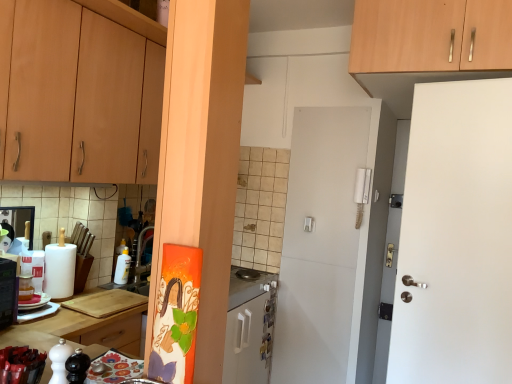
Question: Does white plastic salt shaker at lower left have a greater height compared to wooden cutting board at lower center?

Choices:
 (A) no
 (B) yes

Answer: (A)

Question: Is white plastic salt shaker at lower left located outside wooden cutting board at lower center?

Choices:
 (A) yes
 (B) no

Answer: (A)

Question: Is wooden cutting board at lower center at the back of white plastic salt shaker at lower left?

Choices:
 (A) no
 (B) yes

Answer: (A)

Question: From the image's perspective, would you say white plastic salt shaker at lower left is positioned over wooden cutting board at lower center?

Choices:
 (A) yes
 (B) no

Answer: (A)

Question: From a real-world perspective, is white plastic salt shaker at lower left positioned over wooden cutting board at lower center based on gravity?

Choices:
 (A) yes
 (B) no

Answer: (A)

Question: In the image, is wooden cutting board at lower center on the left side or the right side of stainless steel gas stove at center?

Choices:
 (A) right
 (B) left

Answer: (B)

Question: In terms of height, does wooden cutting board at lower center look taller or shorter compared to stainless steel gas stove at center?

Choices:
 (A) tall
 (B) short

Answer: (A)

Question: Based on their sizes in the image, would you say wooden cutting board at lower center is bigger or smaller than stainless steel gas stove at center?

Choices:
 (A) big
 (B) small

Answer: (A)

Question: From a real-world perspective, relative to stainless steel gas stove at center, is wooden cutting board at lower center vertically above or below?

Choices:
 (A) above
 (B) below

Answer: (B)

Question: From their relative heights in the image, would you say white plastic salt shaker at lower left is taller or shorter than wooden cutting board at lower left?

Choices:
 (A) short
 (B) tall

Answer: (A)

Question: In the image, is white plastic salt shaker at lower left positioned in front of or behind wooden cutting board at lower left?

Choices:
 (A) front
 (B) behind

Answer: (A)

Question: From a real-world perspective, is white plastic salt shaker at lower left physically located above or below wooden cutting board at lower left?

Choices:
 (A) below
 (B) above

Answer: (B)

Question: From the image's perspective, relative to wooden cutting board at lower left, is white plastic salt shaker at lower left above or below?

Choices:
 (A) above
 (B) below

Answer: (A)

Question: From the image's perspective, is wooden cabinet at upper right, which is the 2th cabinetry from left to right, positioned above or below white plastic salt shaker at lower left?

Choices:
 (A) below
 (B) above

Answer: (B)

Question: From a real-world perspective, relative to white plastic salt shaker at lower left, is wooden cabinet at upper right, the 1th cabinetry viewed from the right, vertically above or below?

Choices:
 (A) above
 (B) below

Answer: (A)